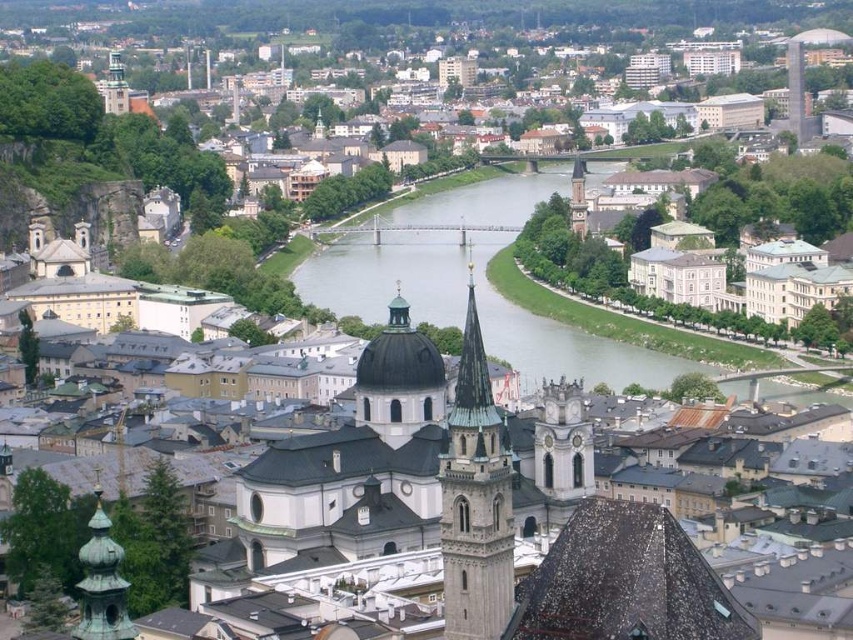
Is silvery waterway at center behind matte gold clock tower at upper left?

That is False.

Is silvery waterway at center shorter than matte gold clock tower at upper left?

No, silvery waterway at center is not shorter than matte gold clock tower at upper left.

Does point (393, 208) come closer to viewer compared to point (109, 108)?

No, (393, 208) is behind (109, 108).

You are a GUI agent. You are given a task and a screenshot of the screen. Output one action in this format:
    pyautogui.click(x=<x>, y=<y>)
    Task: Click on the silvery waterway at center
    The width and height of the screenshot is (853, 640).
    Given the screenshot: What is the action you would take?
    pyautogui.click(x=474, y=280)

The width and height of the screenshot is (853, 640). In order to click on white stone dome at center in this screenshot , I will do `click(399, 380)`.

Is point (425, 384) behind point (80, 634)?

Yes, point (425, 384) is farther from viewer.

At what (x,y) coordinates should I click in order to perform the action: click on white stone dome at center. Please return your answer as a coordinate pair (x, y). This screenshot has width=853, height=640. Looking at the image, I should click on pos(399,380).

Is point (384, 397) in front of point (108, 108)?

Yes, it is.

Between white stone dome at center and matte gold clock tower at upper left, which one is positioned higher?

matte gold clock tower at upper left is above.

Is point (409, 326) farther from viewer compared to point (120, 109)?

No, (409, 326) is in front of (120, 109).

Where is `white stone dome at center`? The image size is (853, 640). white stone dome at center is located at coordinates (399, 380).